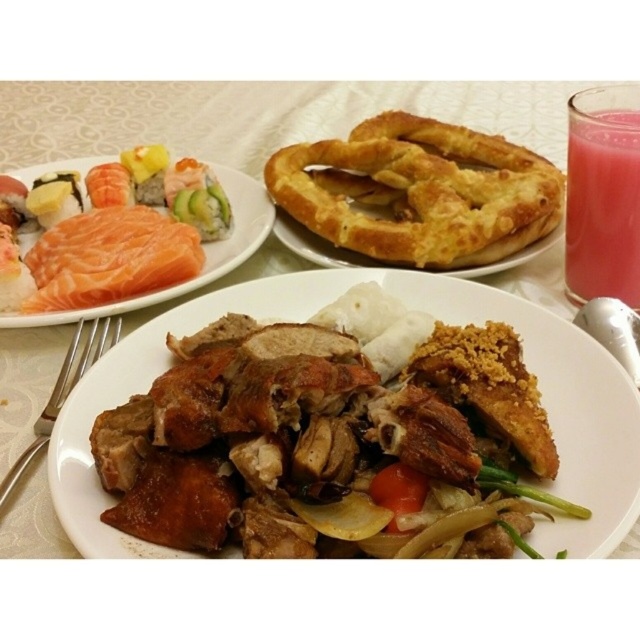
Is golden brown pretzel at upper right above salmon raw at upper left?

Yes, golden brown pretzel at upper right is above salmon raw at upper left.

Between point (474, 200) and point (35, 177), which one is positioned in front?

Point (474, 200) is in front.

Locate an element on the screen. golden brown pretzel at upper right is located at coordinates (419, 193).

Between brown crispy fried chicken at center and pink raw salmon at upper left, which one appears on the left side from the viewer's perspective?

pink raw salmon at upper left is more to the left.

Who is higher up, brown crispy fried chicken at center or pink raw salmon at upper left?

pink raw salmon at upper left

Who is more distant from viewer, (125, 346) or (72, 234)?

The point (72, 234) is behind.

Where is `brown crispy fried chicken at center`? This screenshot has width=640, height=640. brown crispy fried chicken at center is located at coordinates (410, 308).

Is golden brown pretzel at upper right bigger than pink raw salmon at upper left?

Correct, golden brown pretzel at upper right is larger in size than pink raw salmon at upper left.

Does point (288, 189) come closer to viewer compared to point (35, 253)?

No.

Where is `golden brown pretzel at upper right`? golden brown pretzel at upper right is located at coordinates (419, 193).